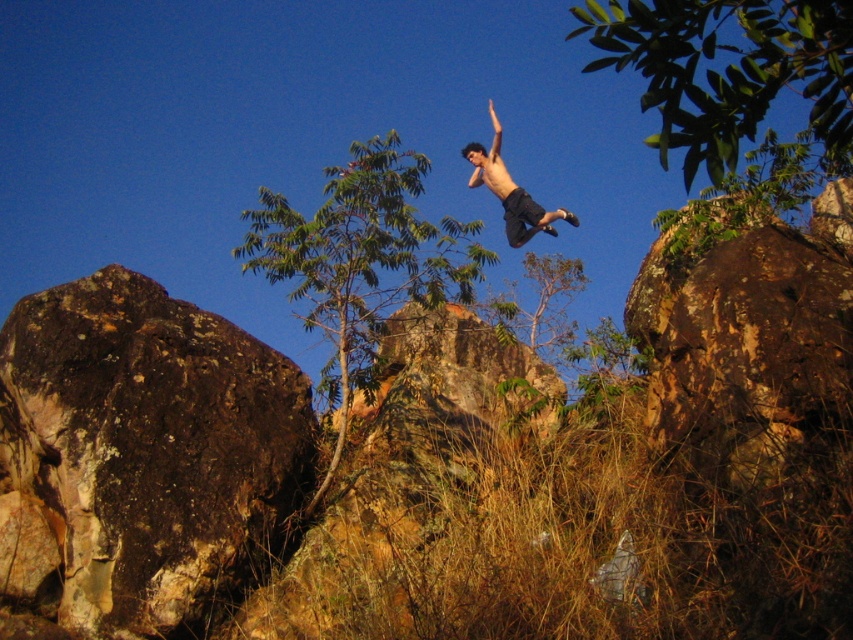
Question: Can you confirm if brown rough rock at left is wider than green leafy tree at upper right?

Choices:
 (A) no
 (B) yes

Answer: (A)

Question: Which point is closer to the camera?

Choices:
 (A) (370, 260)
 (B) (473, 179)
 (C) (212, 534)

Answer: (C)

Question: Which object is closer to the camera taking this photo?

Choices:
 (A) skinny black shorts at center
 (B) brown rough boulder at right
 (C) green leafy tree at center

Answer: (B)

Question: Observing the image, what is the correct spatial positioning of green leafy tree at center in reference to skinny black shorts at center?

Choices:
 (A) right
 (B) left

Answer: (B)

Question: Is brown rough rock at left to the right of green leafy tree at upper right from the viewer's perspective?

Choices:
 (A) yes
 (B) no

Answer: (B)

Question: Which is nearer to the green leafy tree at center?

Choices:
 (A) green leafy tree at upper right
 (B) brown rough rock at left

Answer: (B)